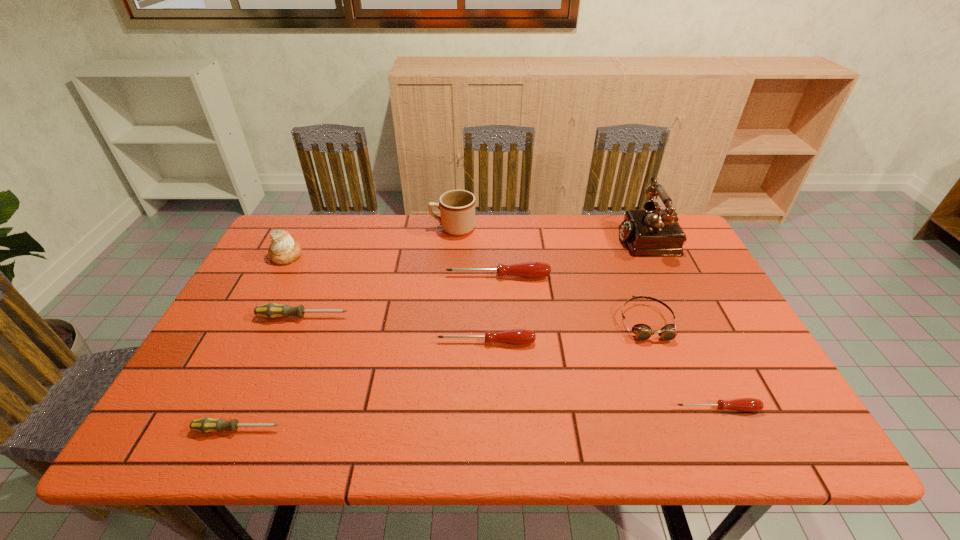
Where is `the second nearest red screwdriver`? the second nearest red screwdriver is located at coordinates (518, 336).

Identify the location of the third farthest screwdriver. (518, 336).

Find the location of a particular element. the smaller gray screwdriver is located at coordinates (208, 424).

The height and width of the screenshot is (540, 960). I want to click on the nearer gray screwdriver, so [208, 424].

Where is `the second nearest screwdriver`? The height and width of the screenshot is (540, 960). the second nearest screwdriver is located at coordinates (744, 404).

Image resolution: width=960 pixels, height=540 pixels. Find the location of `the nearest red screwdriver`. the nearest red screwdriver is located at coordinates (744, 404).

Identify the location of vacant space located on the dial of the brown telephone. (508, 238).

Image resolution: width=960 pixels, height=540 pixels. I want to click on vacant point located on the dial of the brown telephone, so click(x=564, y=238).

In order to click on vacant space located on the dial of the brown telephone in this screenshot , I will do `click(587, 238)`.

Identify the location of free space located 0.180m on the side of the brown mug with the handle. coord(375,228).